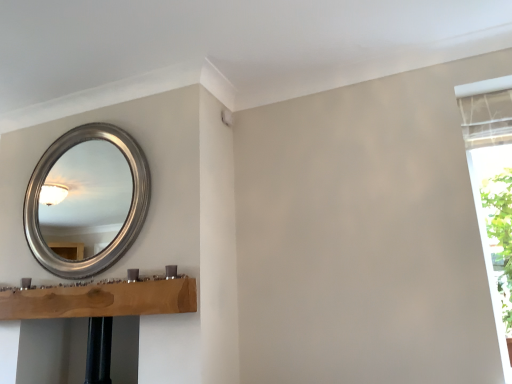
Question: From the image's perspective, relative to white fabric curtain at right, is silver metallic mirror at upper left above or below?

Choices:
 (A) below
 (B) above

Answer: (B)

Question: From a real-world perspective, is silver metallic mirror at upper left above or below white fabric curtain at right?

Choices:
 (A) below
 (B) above

Answer: (B)

Question: Considering the positions of point (102, 208) and point (504, 215), is point (102, 208) closer or farther from the camera than point (504, 215)?

Choices:
 (A) farther
 (B) closer

Answer: (A)

Question: In terms of size, does white fabric curtain at right appear bigger or smaller than silver metallic mirror at upper left?

Choices:
 (A) small
 (B) big

Answer: (B)

Question: Based on their positions, is white fabric curtain at right located to the left or right of silver metallic mirror at upper left?

Choices:
 (A) right
 (B) left

Answer: (A)

Question: From their relative heights in the image, would you say white fabric curtain at right is taller or shorter than silver metallic mirror at upper left?

Choices:
 (A) short
 (B) tall

Answer: (B)

Question: Considering their positions, is white fabric curtain at right located in front of or behind silver metallic mirror at upper left?

Choices:
 (A) front
 (B) behind

Answer: (A)